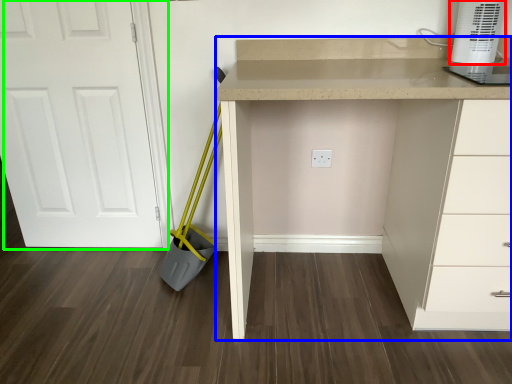
Question: Based on their relative distances, which object is nearer to home appliance (highlighted by a red box)? Choose from computer desk (highlighted by a blue box) and door (highlighted by a green box).

Choices:
 (A) computer desk
 (B) door

Answer: (A)